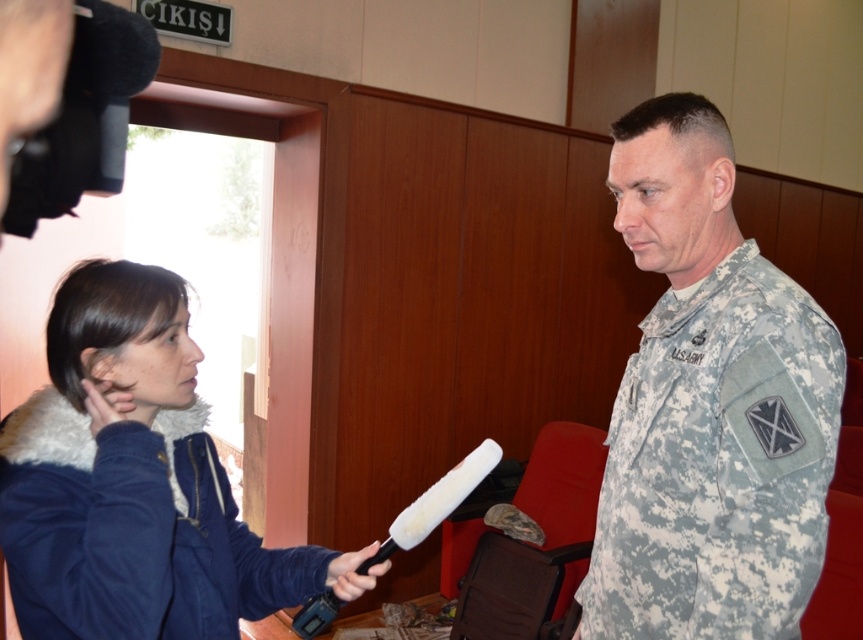
Question: Which point is farther from the camera taking this photo?

Choices:
 (A) (257, 609)
 (B) (594, 554)

Answer: (B)

Question: Can you confirm if camouflage fabric uniform at center is thinner than black rubber microphone at center?

Choices:
 (A) no
 (B) yes

Answer: (A)

Question: Which point is farther to the camera?

Choices:
 (A) black rubber microphone at center
 (B) navy blue fleece jacket at lower left
 (C) camouflage fabric uniform at center

Answer: (A)

Question: Which of the following is the closest to the observer?

Choices:
 (A) navy blue fleece jacket at lower left
 (B) black rubber microphone at center

Answer: (A)

Question: Observing the image, what is the correct spatial positioning of navy blue fleece jacket at lower left in reference to black rubber microphone at center?

Choices:
 (A) above
 (B) below

Answer: (A)

Question: Is the position of camouflage fabric uniform at center more distant than that of navy blue fleece jacket at lower left?

Choices:
 (A) yes
 (B) no

Answer: (A)